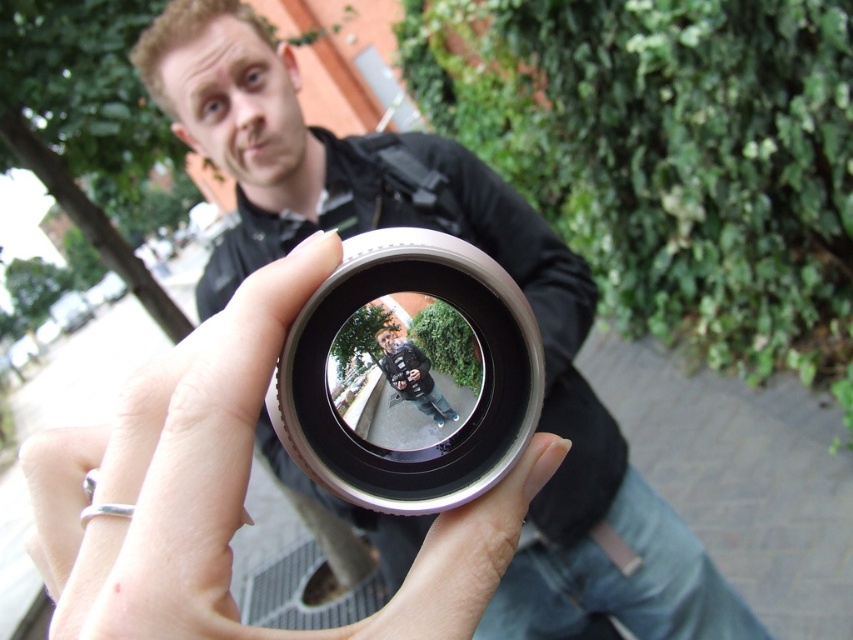
Question: Is silver metallic ring at center wider than silver metallic lens at center?

Choices:
 (A) yes
 (B) no

Answer: (A)

Question: Does silver metallic ring at center appear on the right side of silver metallic lens at center?

Choices:
 (A) yes
 (B) no

Answer: (B)

Question: Does silver metallic ring at center have a smaller size compared to silver metallic lens at center?

Choices:
 (A) yes
 (B) no

Answer: (B)

Question: Among these points, which one is nearest to the camera?

Choices:
 (A) (427, 508)
 (B) (77, 612)

Answer: (B)

Question: Which point appears closest to the camera in this image?

Choices:
 (A) (183, 481)
 (B) (347, 500)

Answer: (A)